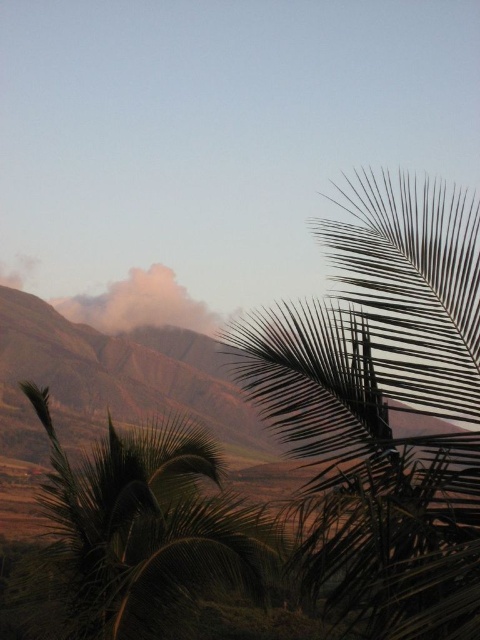
Question: Which of the following is the farthest from the observer?

Choices:
 (A) green leafy palm at lower left
 (B) dark green leafy palm at right

Answer: (A)

Question: Is dark green leafy palm at right smaller than green leafy palm at lower left?

Choices:
 (A) no
 (B) yes

Answer: (B)

Question: Does dark green leafy palm at right appear on the right side of green leafy palm at lower left?

Choices:
 (A) yes
 (B) no

Answer: (A)

Question: Is dark green leafy palm at right above green leafy palm at lower left?

Choices:
 (A) yes
 (B) no

Answer: (A)